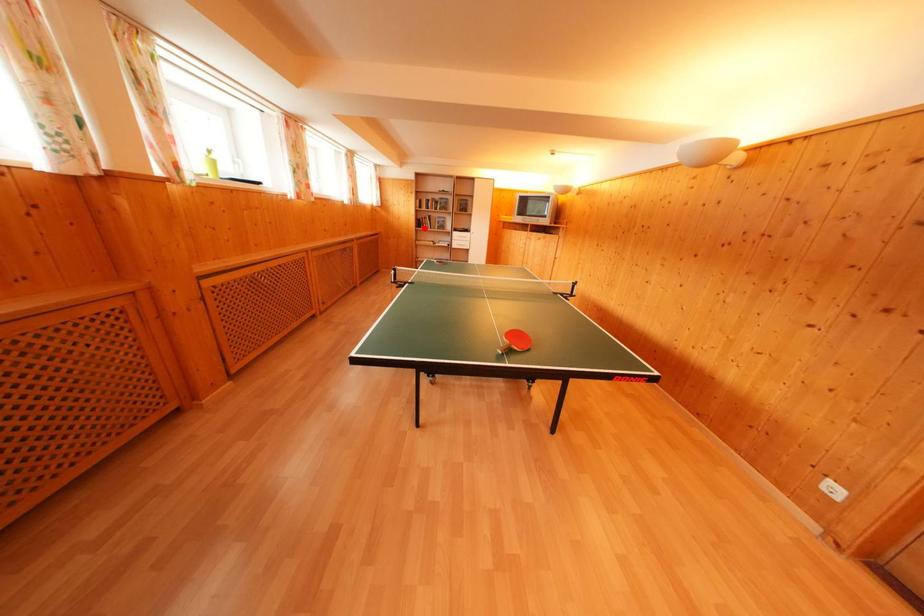
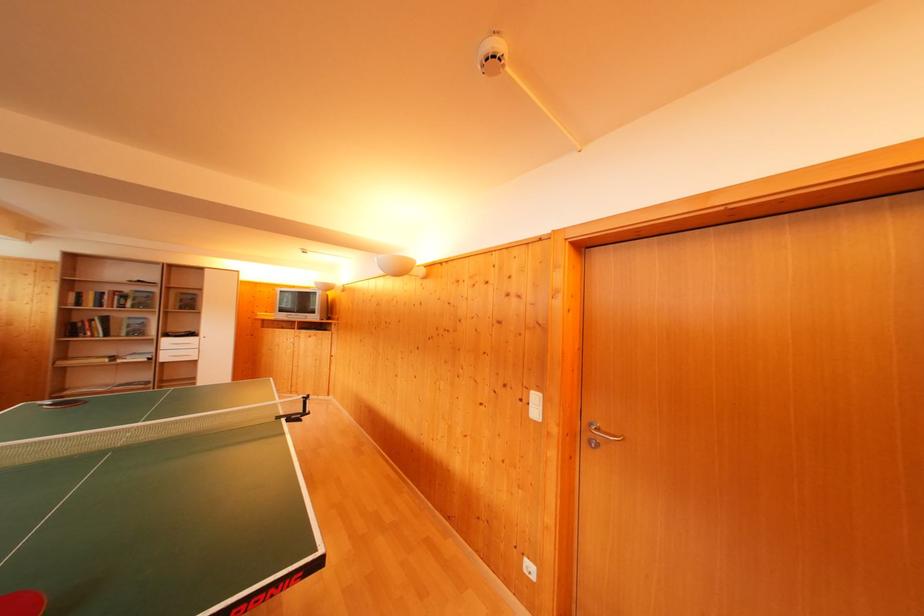
Question: I am providing you with two images of the same scene from different viewpoints. Image1 has a red point marked. In image2, the corresponding 3D location appears at what relative position? Reply with the corresponding letter.

Choices:
 (A) Closer
 (B) Farther

Answer: (B)